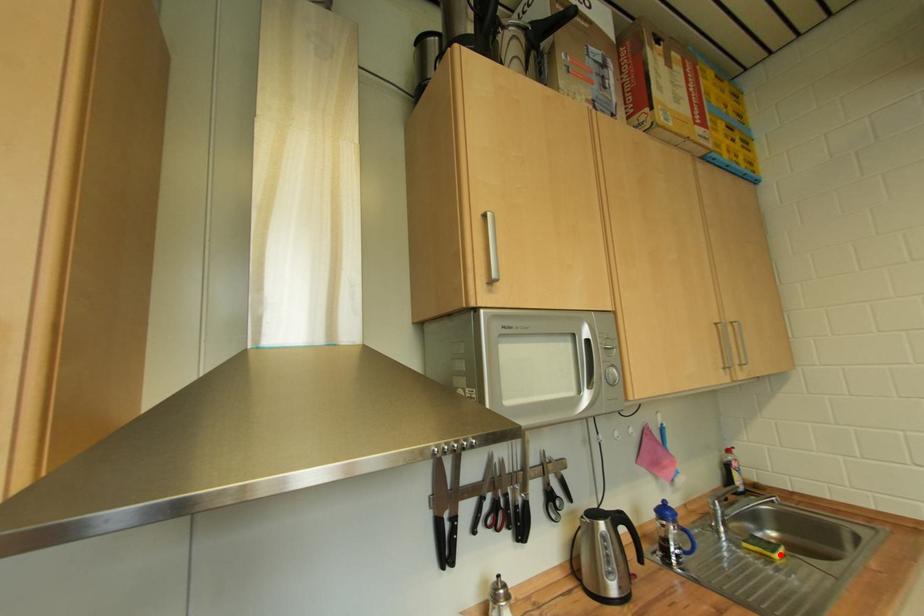
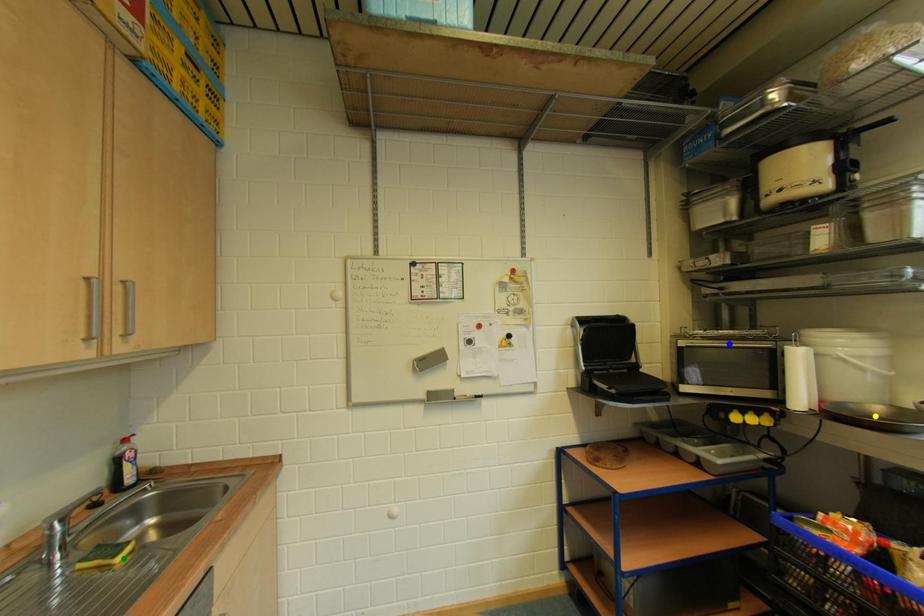
Question: I am providing you with two images of the same scene from different viewpoints. A red point is marked on the first image. You are given multiple points on the second image. Which point in image 2 is actually the same real-world point as the red point in image 1?

Choices:
 (A) green point
 (B) blue point
 (C) yellow point

Answer: (A)